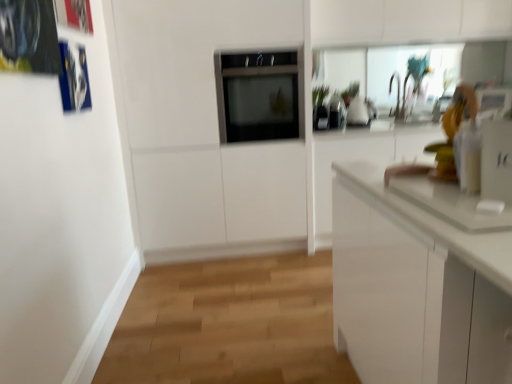
Question: Considering the relative sizes of white glossy soap dispenser at right and satin black oven at center in the image provided, is white glossy soap dispenser at right thinner than satin black oven at center?

Choices:
 (A) yes
 (B) no

Answer: (A)

Question: From a real-world perspective, is white glossy soap dispenser at right positioned over satin black oven at center based on gravity?

Choices:
 (A) no
 (B) yes

Answer: (A)

Question: Is white glossy soap dispenser at right smaller than satin black oven at center?

Choices:
 (A) yes
 (B) no

Answer: (A)

Question: Would you consider white glossy soap dispenser at right to be distant from satin black oven at center?

Choices:
 (A) yes
 (B) no

Answer: (A)

Question: Is white glossy soap dispenser at right in contact with satin black oven at center?

Choices:
 (A) no
 (B) yes

Answer: (A)

Question: Can you confirm if white glossy soap dispenser at right is shorter than satin black oven at center?

Choices:
 (A) yes
 (B) no

Answer: (A)

Question: Is satin black oven at center positioned beyond the bounds of white glossy soap dispenser at right?

Choices:
 (A) yes
 (B) no

Answer: (A)

Question: Can you confirm if satin black oven at center is wider than white glossy soap dispenser at right?

Choices:
 (A) yes
 (B) no

Answer: (A)

Question: Is satin black oven at center not close to white glossy soap dispenser at right?

Choices:
 (A) no
 (B) yes

Answer: (B)

Question: Does satin black oven at center have a lesser width compared to white glossy soap dispenser at right?

Choices:
 (A) yes
 (B) no

Answer: (B)

Question: Would you say satin black oven at center contains white glossy soap dispenser at right?

Choices:
 (A) no
 (B) yes

Answer: (A)

Question: From the image's perspective, is satin black oven at center located above white glossy soap dispenser at right?

Choices:
 (A) no
 (B) yes

Answer: (B)

Question: Considering the positions of satin black oven at center and white glossy soap dispenser at right in the image, is satin black oven at center taller or shorter than white glossy soap dispenser at right?

Choices:
 (A) tall
 (B) short

Answer: (A)